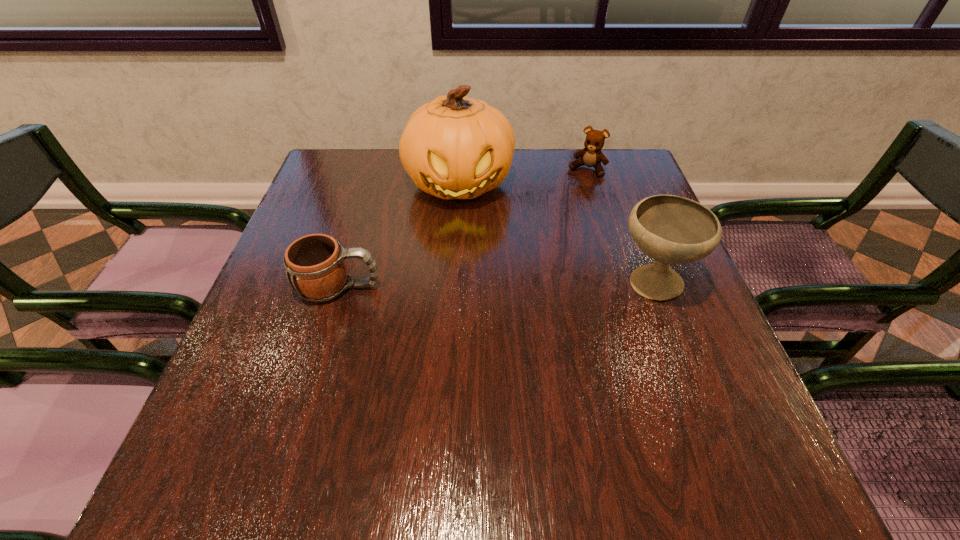
I want to click on vacant point at the near edge, so click(x=388, y=396).

This screenshot has width=960, height=540. In the image, there is a desktop. What are the coordinates of `blank space at the left edge` in the screenshot? It's located at (287, 249).

Where is `free space at the right edge`? Image resolution: width=960 pixels, height=540 pixels. free space at the right edge is located at coordinates (607, 201).

Locate an element on the screen. This screenshot has width=960, height=540. vacant space at the far left corner is located at coordinates (368, 158).

At what (x,y) coordinates should I click in order to perform the action: click on free space at the far right corner. Please return your answer as a coordinate pair (x, y). Image resolution: width=960 pixels, height=540 pixels. Looking at the image, I should click on (587, 167).

Locate an element on the screen. This screenshot has width=960, height=540. free space between the chalice and the third object from right to left is located at coordinates (556, 233).

Image resolution: width=960 pixels, height=540 pixels. What are the coordinates of `vacant area between the teddy bear and the pumpkin` in the screenshot? It's located at (523, 177).

The height and width of the screenshot is (540, 960). I want to click on free spot between the leftmost object and the teddy bear, so click(x=464, y=228).

Where is `vacant space that's between the pumpkin and the teddy bear`? vacant space that's between the pumpkin and the teddy bear is located at coordinates coord(523,177).

This screenshot has width=960, height=540. Identify the location of vacant region between the mug and the second tallest object. (495, 285).